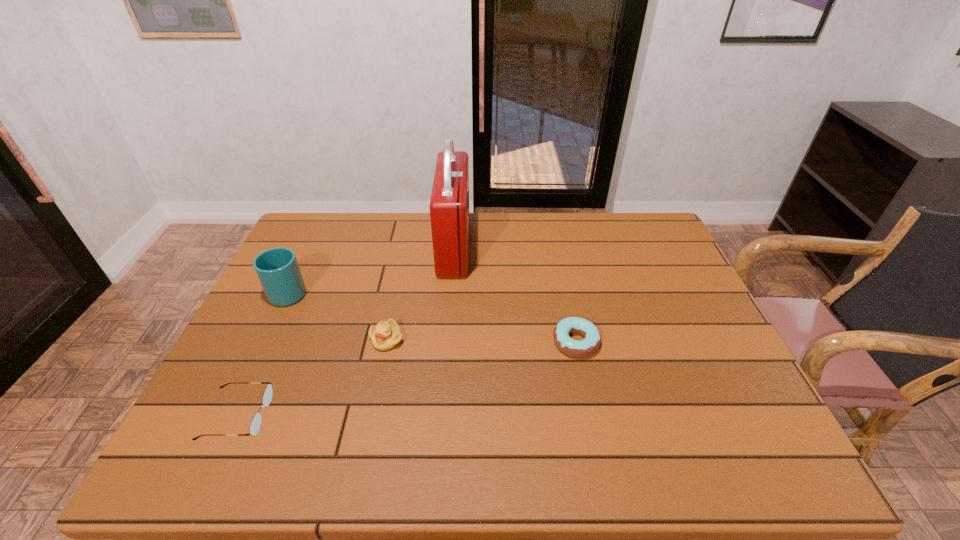
Identify the location of the first-aid kit. (449, 205).

Identify the location of the tallest object. (449, 205).

Image resolution: width=960 pixels, height=540 pixels. In order to click on the second tallest object in this screenshot , I will do `click(278, 271)`.

Locate an element on the screen. The width and height of the screenshot is (960, 540). the third object from right to left is located at coordinates click(x=386, y=335).

In order to click on duckling in this screenshot , I will do `click(386, 335)`.

You are a GUI agent. You are given a task and a screenshot of the screen. Output one action in this format:
    pyautogui.click(x=<x>, y=<y>)
    Task: Click on the spectacles
    The width and height of the screenshot is (960, 540).
    Given the screenshot: What is the action you would take?
    pyautogui.click(x=255, y=424)

Find the location of `doughnut`. doughnut is located at coordinates (578, 348).

Locate an element on the screen. This screenshot has height=540, width=960. vacant area situated 0.380m on the front face of the second object from right to left is located at coordinates (587, 247).

Locate an element on the screen. vacant space located 0.120m on the handle side of the cup is located at coordinates (309, 251).

This screenshot has height=540, width=960. Find the location of `free location located on the handle side of the cup`. free location located on the handle side of the cup is located at coordinates (303, 262).